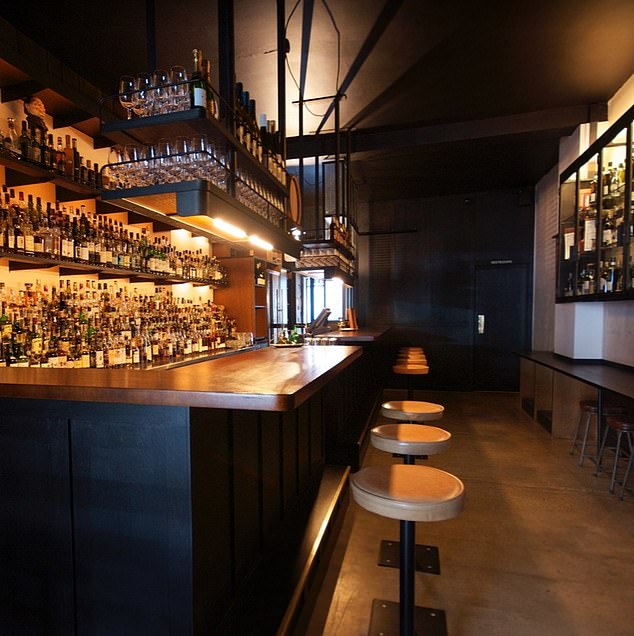
Locate an element on the screen. Image resolution: width=634 pixels, height=636 pixels. lights is located at coordinates (233, 226), (255, 240), (182, 229), (198, 236), (182, 285), (203, 289).